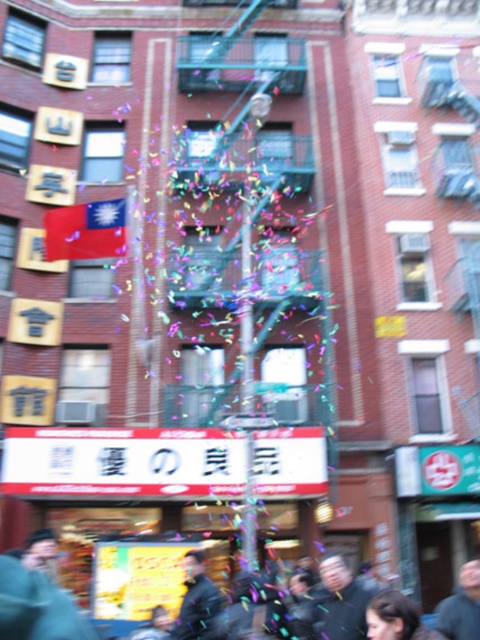
You are a photographer standing in the middle of the lively urban scene. You notice a person wearing a dark gray jacket at center and someone with dark brown hair at center. From your perspective, which object is positioned to the left?

The dark gray jacket at center is to the left of the dark brown hair at center.

You are standing in the lively urban scene and want to determine the distance between two points marked in the image. The first point is at coordinate point (190,577) and the second is at point (430,637). Given that the first point is closer to you than the second, can you estimate which point is nearer to your current position?

Point (190,577) is further to the viewer than point (430,637). Wait, but the question states the first point is closer. Hmm, there might be a mistake here. Let me check the Objects Description again. The description says point (190,577) is further to the viewer than point (430,637). So the answer should be that point (190,577) is farther away, meaning the second point is closer. But the user asked which is nearer. So the answer is point (430,637) is closer? Wait, no, the description says 0